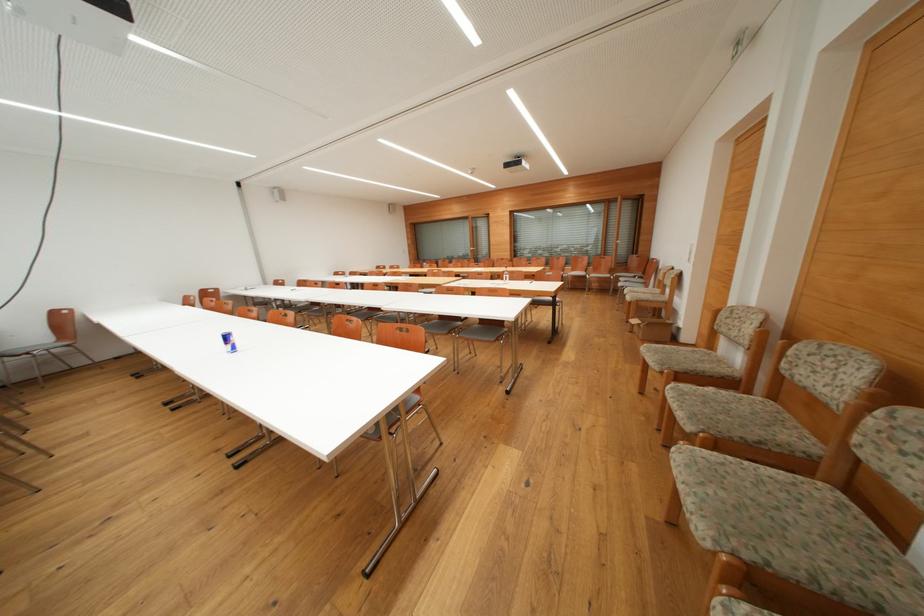
Where is `small cardboard box`? Image resolution: width=924 pixels, height=616 pixels. small cardboard box is located at coordinates (651, 329).